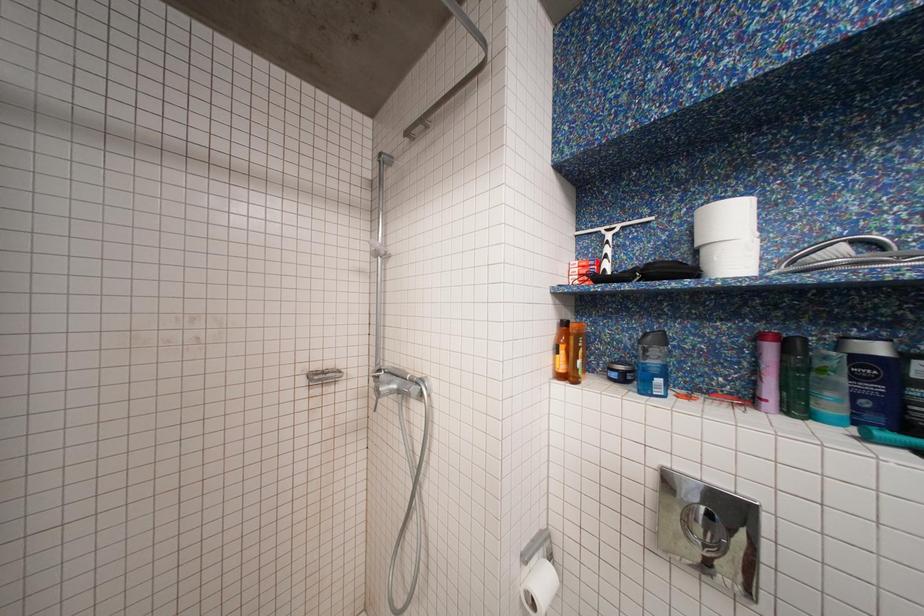
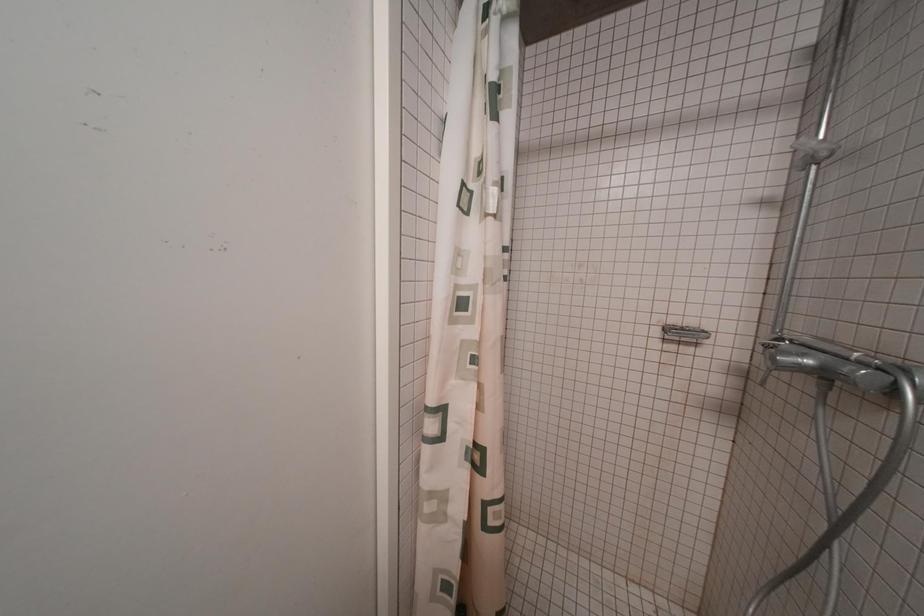
Question: Based on the continuous images, in which direction is the camera rotating? Reply with the corresponding letter.

Choices:
 (A) Left
 (B) Right
 (C) Up
 (D) Down

Answer: (A)